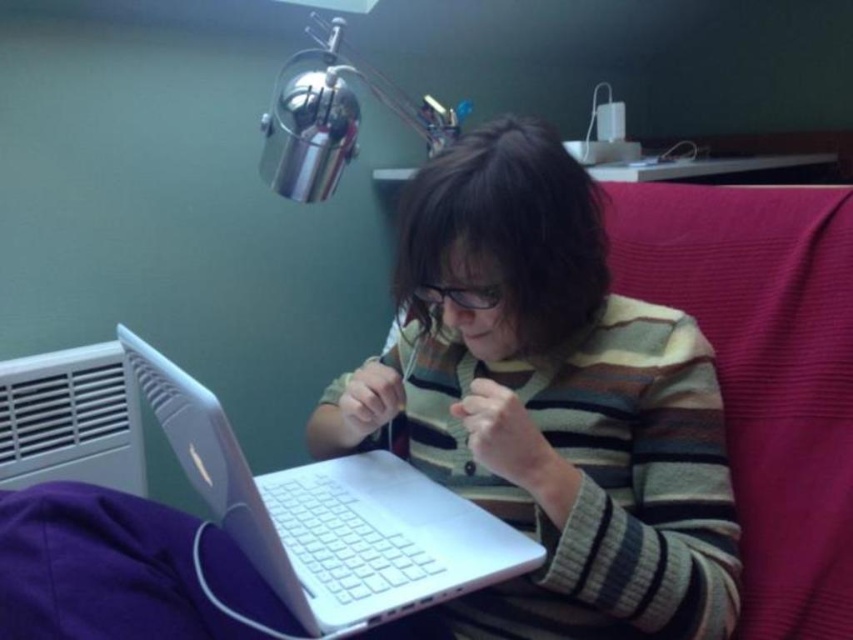
You are designing a new desk layout and need to ensure that the white plastic laptop at center and the brushed metal lamp at upper center are placed in a way that the lamp doesn not block the laptop screen. Based on their heights, which object should be positioned higher to achieve this?

The brushed metal lamp at upper center should be positioned higher since it is taller than the white plastic laptop at center, allowing it to cast light over the laptop without blocking the screen.

Based on the scene description, where is the striped sweater at center positioned relative to the other objects in the room?

The striped sweater at center is located at point coordinates 0.630 on the x axis and 0.648 on the y axis.